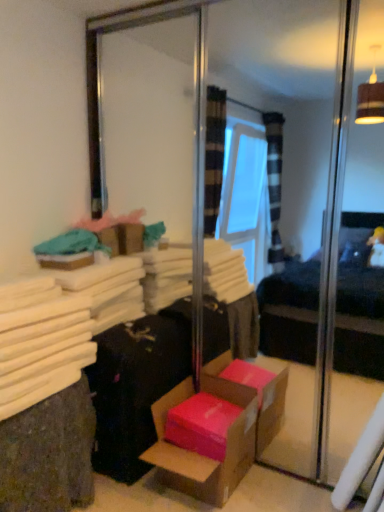
Question: Can you confirm if black fabric suitcase at lower left is smaller than pink cardboard box at lower center?

Choices:
 (A) no
 (B) yes

Answer: (A)

Question: Is the position of black fabric suitcase at lower left less distant than that of pink cardboard box at lower center?

Choices:
 (A) no
 (B) yes

Answer: (A)

Question: From the image's perspective, is black fabric suitcase at lower left beneath pink cardboard box at lower center?

Choices:
 (A) yes
 (B) no

Answer: (B)

Question: Considering the relative positions of black fabric suitcase at lower left and pink cardboard box at lower center in the image provided, is black fabric suitcase at lower left to the right of pink cardboard box at lower center from the viewer's perspective?

Choices:
 (A) yes
 (B) no

Answer: (B)

Question: From a real-world perspective, is black fabric suitcase at lower left positioned over pink cardboard box at lower center based on gravity?

Choices:
 (A) yes
 (B) no

Answer: (A)

Question: From their relative heights in the image, would you say white fabric at left is taller or shorter than pink cardboard box at lower center?

Choices:
 (A) tall
 (B) short

Answer: (A)

Question: Considering their positions, is white fabric at left located in front of or behind pink cardboard box at lower center?

Choices:
 (A) front
 (B) behind

Answer: (A)

Question: From a real-world perspective, is white fabric at left above or below pink cardboard box at lower center?

Choices:
 (A) below
 (B) above

Answer: (B)

Question: In terms of size, does white fabric at left appear bigger or smaller than pink cardboard box at lower center?

Choices:
 (A) big
 (B) small

Answer: (A)

Question: Considering the positions of pink cardboard box at lower center and white fabric at left in the image, is pink cardboard box at lower center taller or shorter than white fabric at left?

Choices:
 (A) tall
 (B) short

Answer: (B)

Question: Is point (168, 449) closer or farther from the camera than point (46, 493)?

Choices:
 (A) farther
 (B) closer

Answer: (A)

Question: Considering the positions of pink cardboard box at lower center and white fabric at left in the image, is pink cardboard box at lower center bigger or smaller than white fabric at left?

Choices:
 (A) small
 (B) big

Answer: (A)

Question: In terms of width, does pink cardboard box at lower center look wider or thinner when compared to white fabric at left?

Choices:
 (A) thin
 (B) wide

Answer: (A)

Question: Is black fabric suitcase at lower left in front of or behind white fabric at left in the image?

Choices:
 (A) behind
 (B) front

Answer: (A)

Question: From a real-world perspective, is black fabric suitcase at lower left above or below white fabric at left?

Choices:
 (A) below
 (B) above

Answer: (B)